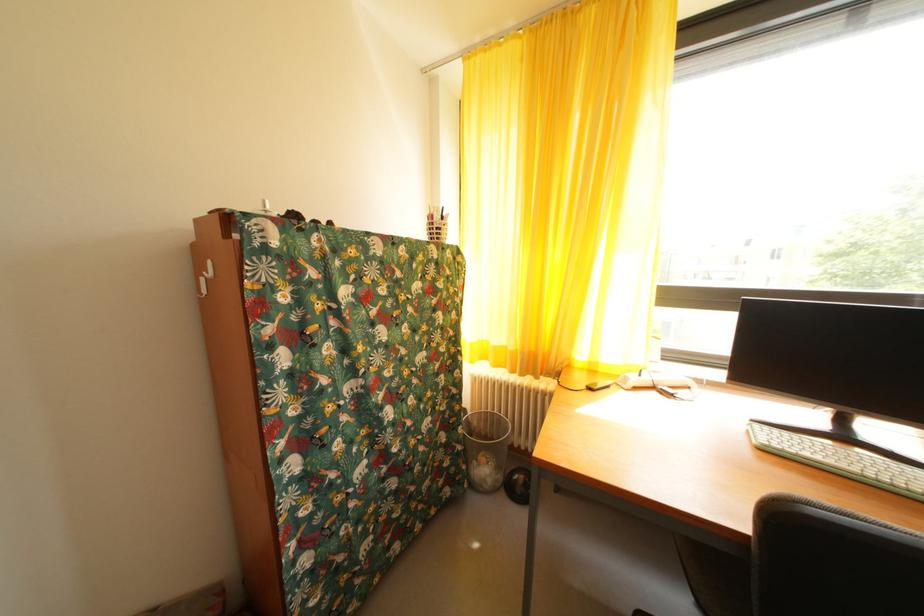
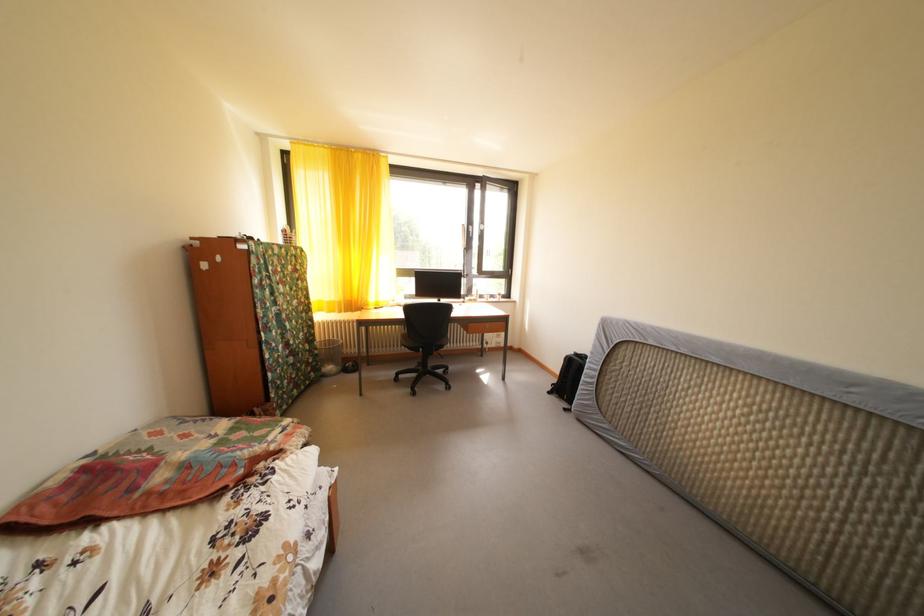
Where in the second image is the point corresponding to (456,452) from the first image?

(320, 357)